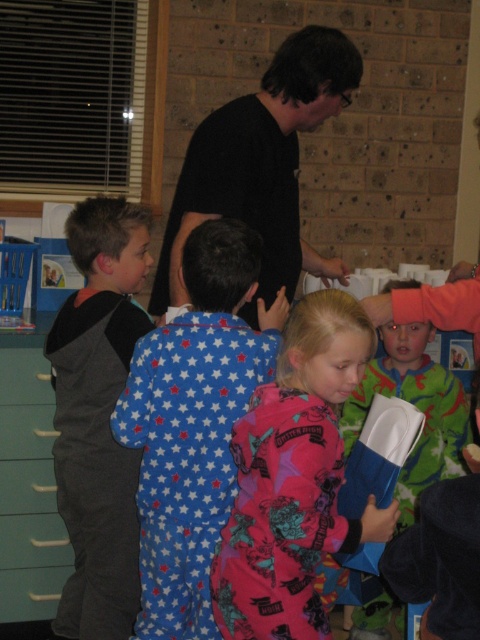
You are a parent trying to store a dark gray fleece hoodie at left and a teal plastic drawer at lower left in a narrow closet. Based on their sizes, which item might not fit through the closet door opening?

The dark gray fleece hoodie at left might not fit through the closet door opening because it might be wider than the teal plastic drawer at lower left, which could pass through more easily.